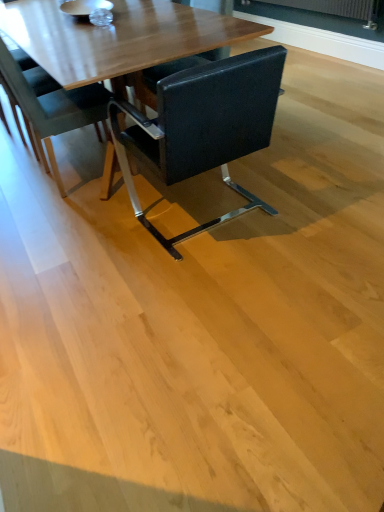
Locate an element on the screen. free point below black leather chair at center, the second chair in the left-to-right sequence (from a real-world perspective) is located at coordinates (201, 211).